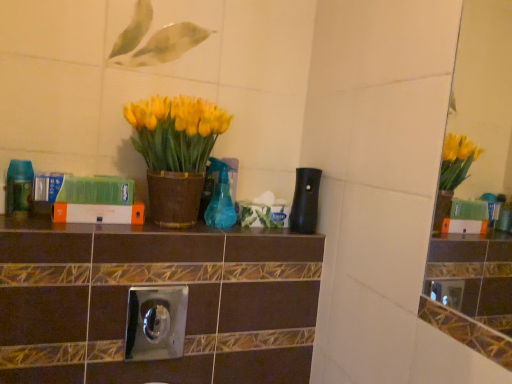
Question: Does matte brown pot at center have a lesser height compared to translucent blue spray bottle at center, the 2th bottle viewed from the right?

Choices:
 (A) yes
 (B) no

Answer: (B)

Question: From the image's perspective, would you say matte brown pot at center is positioned over translucent blue spray bottle at center, which is the second bottle in left-to-right order?

Choices:
 (A) yes
 (B) no

Answer: (A)

Question: Can you confirm if matte brown pot at center is positioned to the right of translucent blue spray bottle at center, the 2th bottle viewed from the right?

Choices:
 (A) yes
 (B) no

Answer: (B)

Question: Is matte brown pot at center outside of translucent blue spray bottle at center, which is the second bottle in left-to-right order?

Choices:
 (A) no
 (B) yes

Answer: (B)

Question: From a real-world perspective, is matte brown pot at center on top of translucent blue spray bottle at center, the 2th bottle viewed from the right?

Choices:
 (A) yes
 (B) no

Answer: (A)

Question: Looking at the image, does black matte bottle at center, which appears as the 3th bottle when viewed from the left, seem bigger or smaller compared to matte brown pot at center?

Choices:
 (A) big
 (B) small

Answer: (B)

Question: Would you say black matte bottle at center, the 1th bottle viewed from the right, is inside or outside matte brown pot at center?

Choices:
 (A) outside
 (B) inside

Answer: (A)

Question: In the image, is black matte bottle at center, which appears as the 3th bottle when viewed from the left, on the left side or the right side of matte brown pot at center?

Choices:
 (A) left
 (B) right

Answer: (B)

Question: Relative to matte brown pot at center, is black matte bottle at center, which appears as the 3th bottle when viewed from the left, in front or behind?

Choices:
 (A) front
 (B) behind

Answer: (B)

Question: Considering the positions of translucent green bottle at left, the first bottle positioned from the left, and black matte bottle at center, which appears as the 3th bottle when viewed from the left, in the image, is translucent green bottle at left, the first bottle positioned from the left, taller or shorter than black matte bottle at center, which appears as the 3th bottle when viewed from the left,?

Choices:
 (A) tall
 (B) short

Answer: (B)

Question: Is translucent green bottle at left, which appears as the 3th bottle when viewed from the right, situated inside black matte bottle at center, which appears as the 3th bottle when viewed from the left, or outside?

Choices:
 (A) outside
 (B) inside

Answer: (A)

Question: From the image's perspective, relative to black matte bottle at center, which appears as the 3th bottle when viewed from the left, is translucent green bottle at left, which appears as the 3th bottle when viewed from the right, above or below?

Choices:
 (A) below
 (B) above

Answer: (B)

Question: Considering the positions of point (13, 158) and point (290, 211), is point (13, 158) closer or farther from the camera than point (290, 211)?

Choices:
 (A) closer
 (B) farther

Answer: (A)

Question: Does point (6, 185) appear closer or farther from the camera than point (181, 120)?

Choices:
 (A) closer
 (B) farther

Answer: (B)

Question: From the image's perspective, is translucent green bottle at left, the first bottle positioned from the left, positioned above or below matte brown pot at center?

Choices:
 (A) below
 (B) above

Answer: (A)